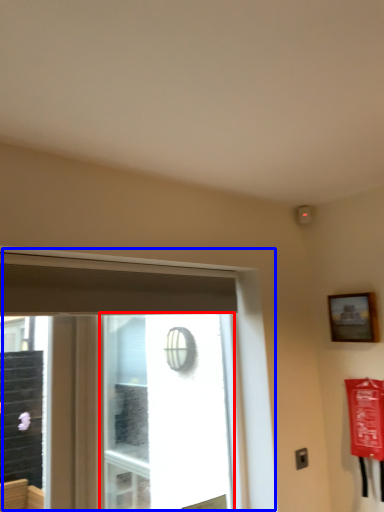
Question: Which of the following is the farthest to the observer, window screen (highlighted by a red box) or window (highlighted by a blue box)?

Choices:
 (A) window screen
 (B) window

Answer: (A)